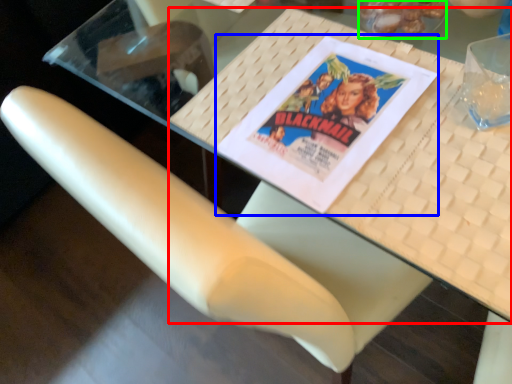
Question: Considering the real-world distances, which object is closest to table (highlighted by a red box)? paperback book (highlighted by a blue box) or food (highlighted by a green box).

Choices:
 (A) paperback book
 (B) food

Answer: (A)